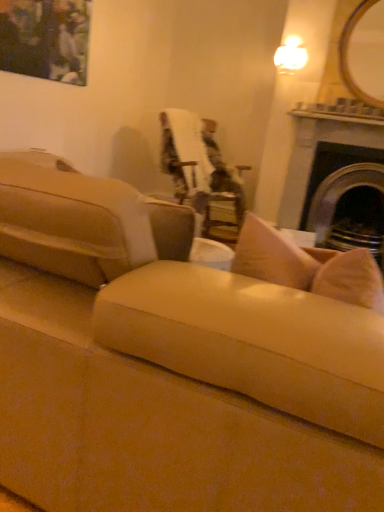
Question: Does point (236, 369) appear closer or farther from the camera than point (372, 47)?

Choices:
 (A) farther
 (B) closer

Answer: (B)

Question: Considering the relative positions of suede beige couch at center, the first studio couch when ordered from left to right, and wooden framed mirror at upper right in the image provided, is suede beige couch at center, the first studio couch when ordered from left to right, to the left or to the right of wooden framed mirror at upper right?

Choices:
 (A) right
 (B) left

Answer: (B)

Question: Which is farther from the wooden framed mirror at upper right?

Choices:
 (A) dark gray stone fireplace at right
 (B) matte black painting at upper left
 (C) velvet upholstered chair at center
 (D) suede beige couch at center, the 1th studio couch positioned from the right
 (E) suede beige couch at center, the first studio couch when ordered from left to right

Answer: (E)

Question: Considering the real-world distances, which object is closest to the matte black painting at upper left?

Choices:
 (A) velvet upholstered chair at center
 (B) wooden framed mirror at upper right
 (C) suede beige couch at center, the 1th studio couch positioned from the right
 (D) suede beige couch at center, the 2th studio couch from the right
 (E) dark gray stone fireplace at right

Answer: (A)